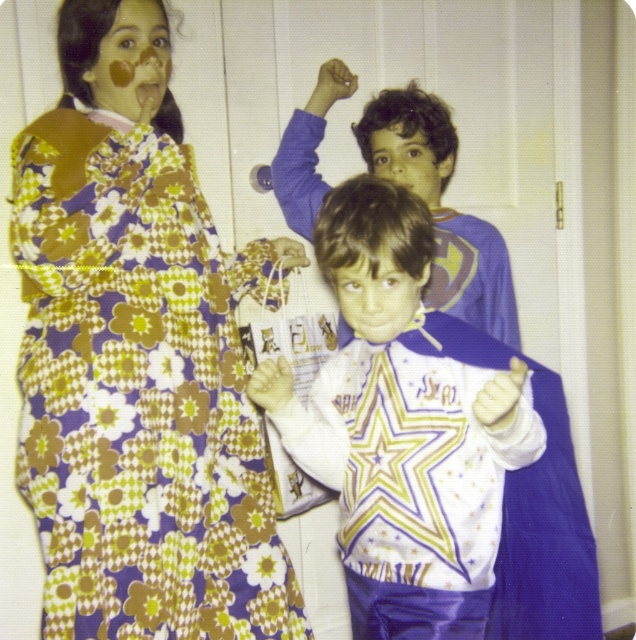
Looking at this image, you are a photographer trying to focus on the matte brown face at upper left and the smooth white shirt at center. Which object should you adjust your camera to focus on first if you want to capture both in sharp detail?

The matte brown face at upper left is located above the smooth white shirt at center, so you should focus on the matte brown face at upper left first because it is closer to the camera.

You are a photographer standing 3 feet away from the white satin star at center. Can you reach it without moving your feet?

The white satin star at center is 3.36 feet away from the viewer. Since you are standing 3 feet away, you cannot reach it without moving closer.

You are standing in front of the image and want to touch the matte brown face at upper left and the smooth white shirt at center. Which one can you reach first without moving your hand?

The matte brown face at upper left is closer to you than the smooth white shirt at center, so you can reach the matte brown face at upper left first.